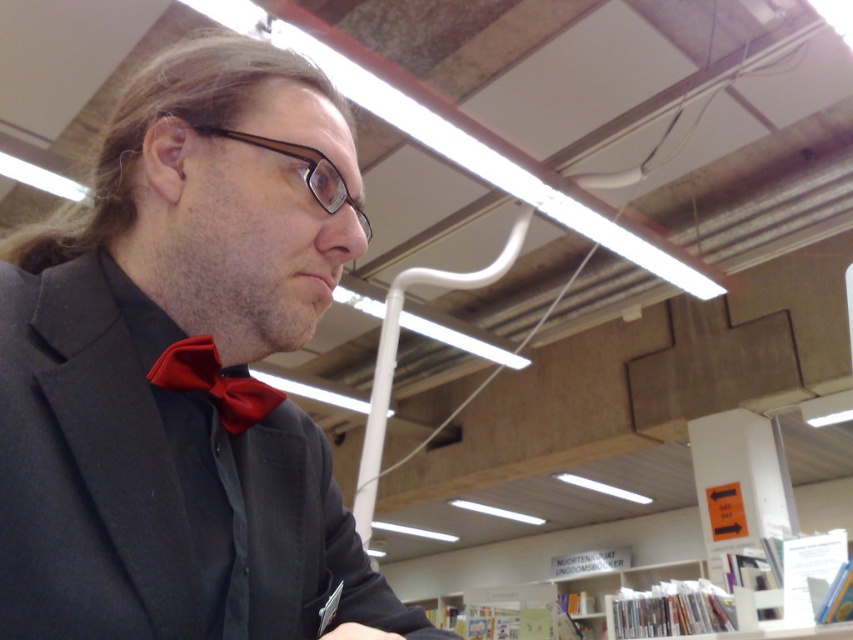
You are a fashion designer observing a person in a library. You notice the matte red bow tie at center and the brown plastic glasses at center. Which item is located below the other?

The matte red bow tie at center is positioned under the brown plastic glasses at center.

You are standing in a library and see two points marked in the image. Which point is nearer to you, point (154, 362) or point (329, 192)?

Point (154, 362) is closer to the viewer than point (329, 192).

Based on the photo, you are an interior designer planning to place a new lamp in the library. The lamp requires a space of 0.3 meters in width. Can the area around the matte black suit at center accommodate the lamp?

The matte black suit at center is located at point (x=184, y=371). Since the lamp requires 0.3 meters in width, we need to check the available space around the coordinates provided. However, without specific spatial dimensions or clearance details, it is uncertain if the area can accommodate the lamp. Please provide more information about the surrounding space.